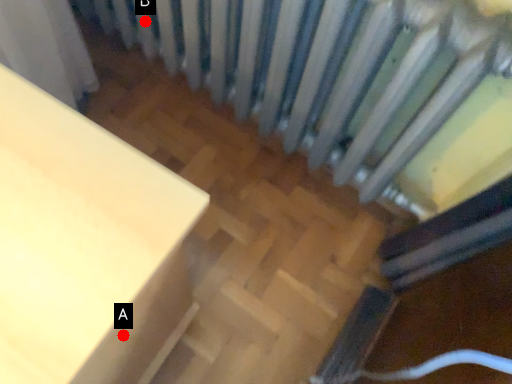
Question: Two points are circled on the image, labeled by A and B beside each circle. Which point is closer to the camera?

Choices:
 (A) A is closer
 (B) B is closer

Answer: (A)